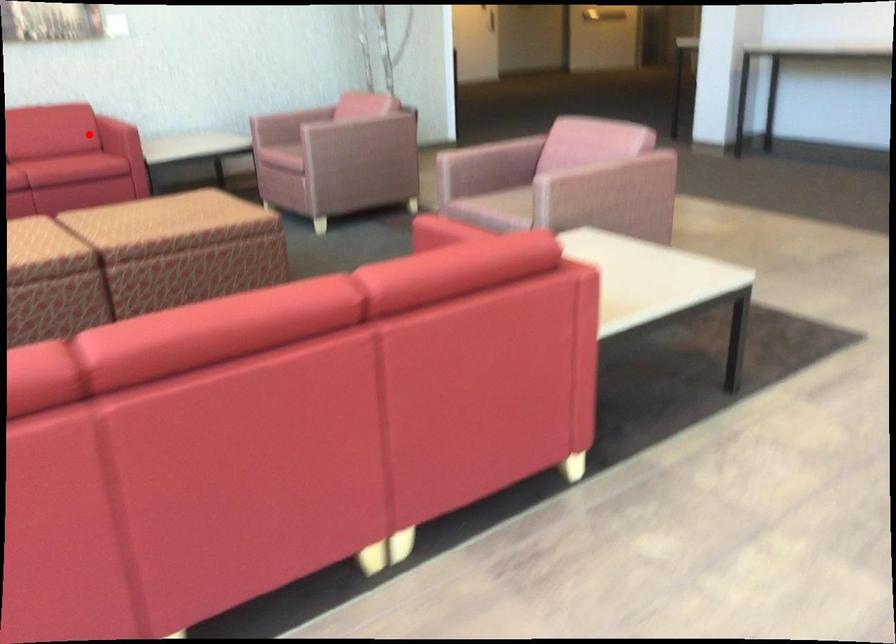
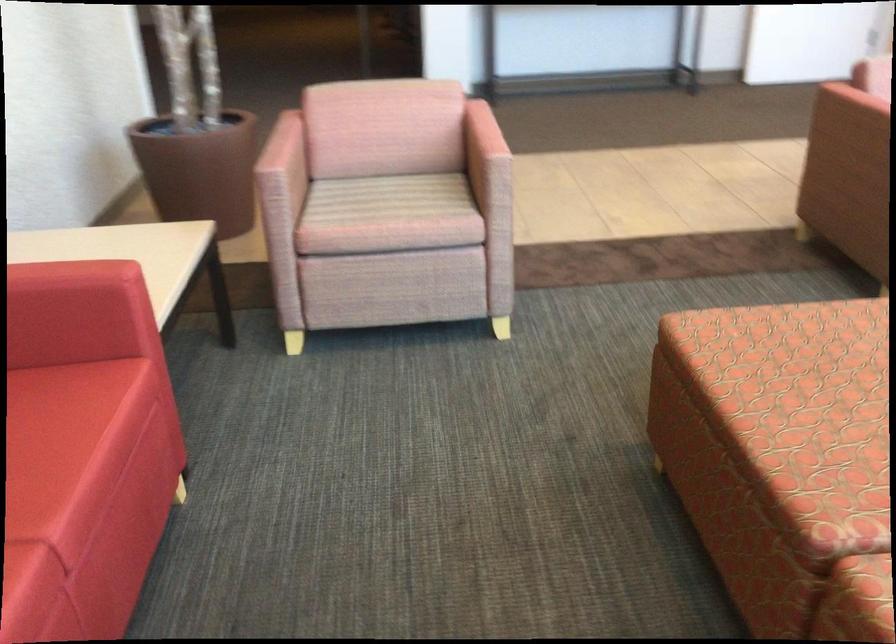
Question: I am providing you with two images of the same scene from different viewpoints. In image1, a red point is highlighted. Considering the same 3D point in image2, which of the following is correct?

Choices:
 (A) It is closer
 (B) It is farther

Answer: (A)